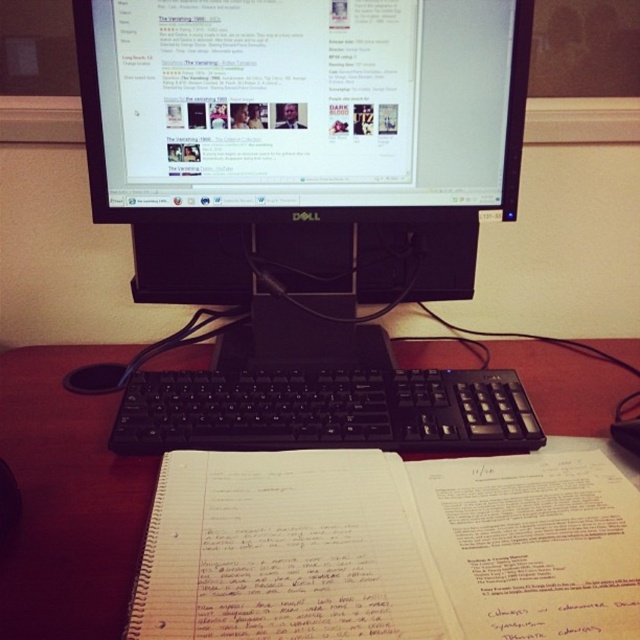
Who is lower down, wooden at center or black plastic keyboard at center?

wooden at center is below.

In the scene shown: Between wooden at center and black plastic keyboard at center, which one is positioned higher?

black plastic keyboard at center

Identify the location of wooden at center. This screenshot has height=640, width=640. (67, 500).

I want to click on wooden at center, so click(x=67, y=500).

Is black matte monitor at upper center in front of black plastic mouse at lower left?

Yes, it is in front of black plastic mouse at lower left.

Is point (397, 38) positioned in front of point (113, 390)?

Yes, it is.

Locate an element on the screen. The image size is (640, 640). black matte monitor at upper center is located at coordinates (301, 106).

Is point (131, 129) closer to camera compared to point (323, 401)?

No, it is behind (323, 401).

Image resolution: width=640 pixels, height=640 pixels. Find the location of `black plastic monitor at center`. black plastic monitor at center is located at coordinates click(308, 198).